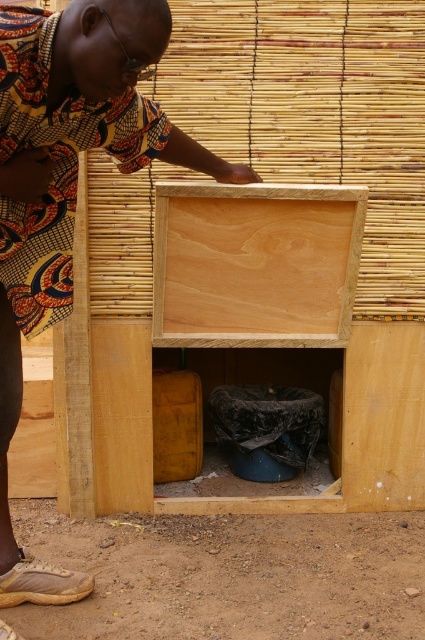
Can you confirm if printed fabric shirt at center is wider than natural wood crate at center?

Yes, printed fabric shirt at center is wider than natural wood crate at center.

Who is higher up, printed fabric shirt at center or natural wood crate at center?

natural wood crate at center is above.

Between point (42, 294) and point (258, 346), which one is positioned in front?

Point (42, 294) is more forward.

Find the location of a particular element. printed fabric shirt at center is located at coordinates (67, 189).